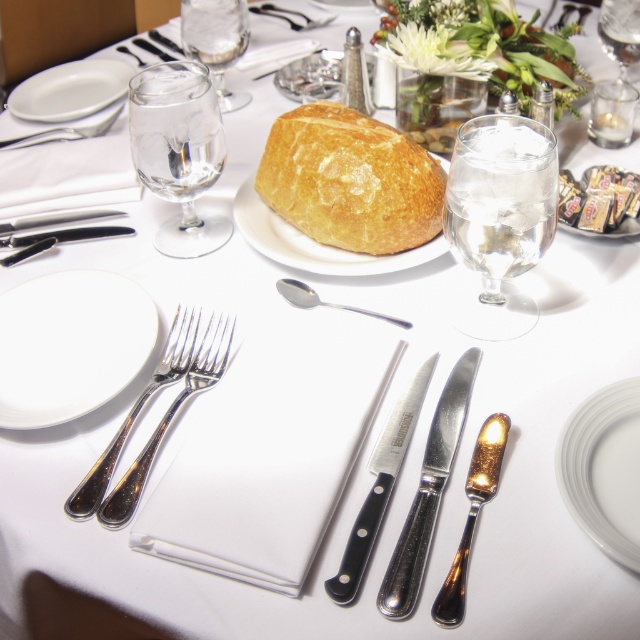
Is clear glass water at upper right positioned in front of black polished knife at center?

No.

Can you confirm if clear glass water at upper right is smaller than black polished knife at center?

No, clear glass water at upper right is not smaller than black polished knife at center.

This screenshot has height=640, width=640. Describe the element at coordinates (500, 216) in the screenshot. I see `clear glass water at upper right` at that location.

This screenshot has width=640, height=640. I want to click on clear glass water at upper right, so click(500, 216).

Between point (93, 125) and point (352, 308), which one is positioned behind?

The point (93, 125) is more distant.

Can you confirm if polished silver fork at upper left is thinner than polished silver spoon at center?

No, polished silver fork at upper left is not thinner than polished silver spoon at center.

Is point (42, 131) positioned in front of point (301, 300)?

No, it is not.

The height and width of the screenshot is (640, 640). Find the location of `polished silver fork at upper left`. polished silver fork at upper left is located at coordinates (61, 132).

Who is shorter, polished silver knife at center or clear glass wine glass at upper right?

clear glass wine glass at upper right is shorter.

The width and height of the screenshot is (640, 640). Describe the element at coordinates (428, 492) in the screenshot. I see `polished silver knife at center` at that location.

Is point (474, 349) more distant than point (636, 56)?

That is False.

Find the location of a particular element. The height and width of the screenshot is (640, 640). polished silver knife at center is located at coordinates (428, 492).